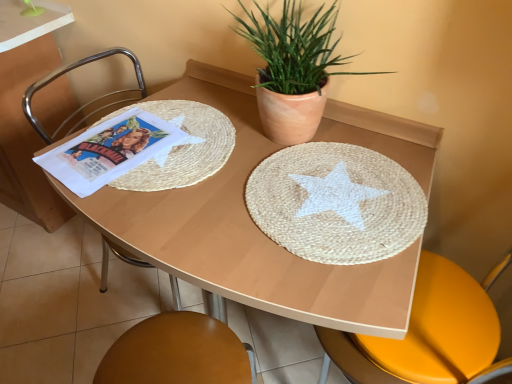
The image size is (512, 384). What are the coordinates of `vacant space underneath terracotta clay pot at upper center (from a real-world perspective)` in the screenshot? It's located at (284, 142).